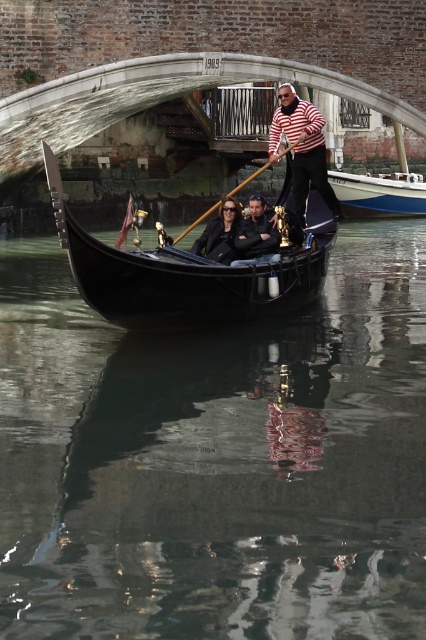
Measure the distance between black polished wood gondola at center and blue polished wood boat at center.

A distance of 20.68 meters exists between black polished wood gondola at center and blue polished wood boat at center.

Is black polished wood gondola at center below blue polished wood boat at center?

Correct, black polished wood gondola at center is located below blue polished wood boat at center.

Which is in front, point (193, 288) or point (400, 188)?

Positioned in front is point (193, 288).

Locate an element on the screen. black polished wood gondola at center is located at coordinates (187, 273).

Who is shorter, glossy black water at center or concrete stone bridge at center?

Standing shorter between the two is concrete stone bridge at center.

Can you confirm if glossy black water at center is positioned below concrete stone bridge at center?

Indeed, glossy black water at center is positioned under concrete stone bridge at center.

Does point (204, 504) come farther from viewer compared to point (238, 54)?

No, (204, 504) is closer to viewer.

Find the location of a particular element. This screenshot has height=640, width=426. glossy black water at center is located at coordinates (216, 460).

Who is higher up, concrete stone bridge at center or striped cotton shirt at center?

concrete stone bridge at center is higher up.

Is point (39, 131) closer to camera compared to point (311, 148)?

No, it is behind (311, 148).

Is point (14, 132) less distant than point (324, 176)?

No, it is behind (324, 176).

In order to click on concrete stone bridge at center in this screenshot , I will do `click(154, 99)`.